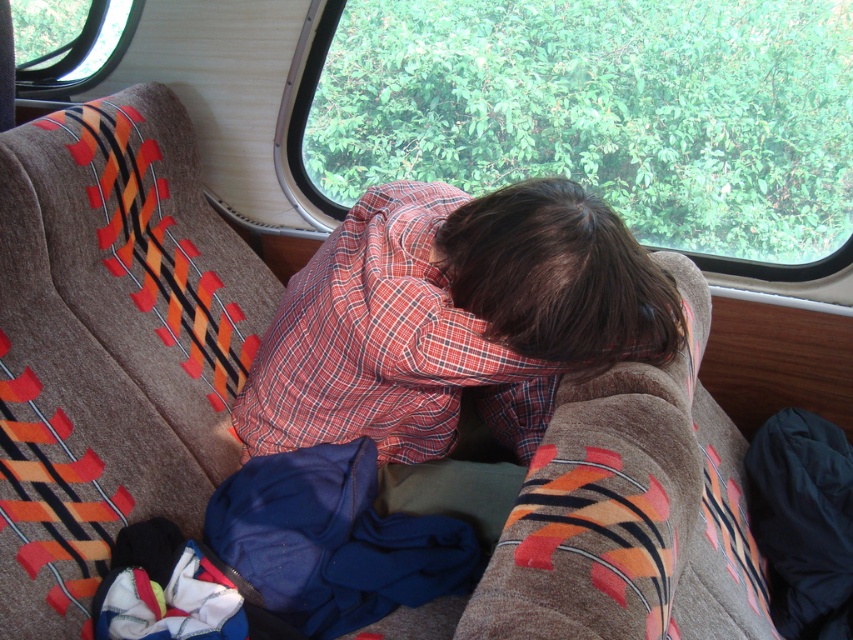
You are packing for a camping trip and need to decide which item to take first between the red plaid shirt at center and the blue fleece sleeping bag at lower center. Based on their sizes, which one should you choose if you have limited space?

The red plaid shirt at center is bigger than the blue fleece sleeping bag at lower center, so you should take the blue fleece sleeping bag at lower center first if you have limited space.

You are a traveler who just arrived at the campsite and wants to store your belongings. You have a red plaid shirt at center and a blue fleece sleeping bag at lower center. Which item should you place on the higher shelf to save space?

The red plaid shirt at center is much taller than the blue fleece sleeping bag at lower center, so you should place the red plaid shirt at center on the higher shelf to save space.

Consider the image. You are organizing the items in the camper van. You need to place a new blanket on the sleeping area. The sleeping area is currently covered by the blue fleece sleeping bag at lower center and the black fabric at lower right. Which item should you remove first to make space?

The blue fleece sleeping bag at lower center is positioned over the black fabric at lower right, so you should remove the blue fleece sleeping bag at lower center first to access the sleeping area underneath.